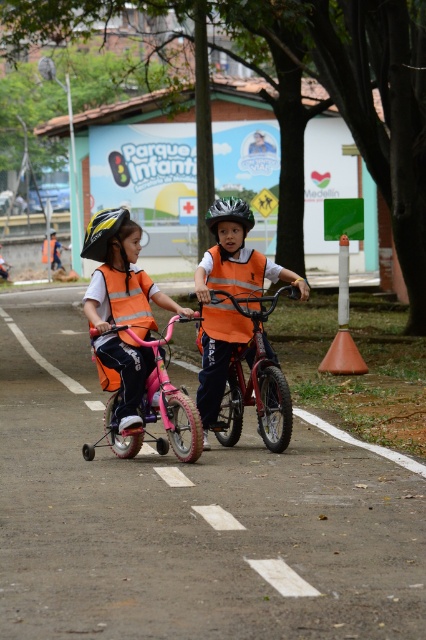
Who is more distant from viewer, (213, 298) or (97, 214)?

The point (97, 214) is behind.

Which of these two, metallic red bicycle at center or yellow matte bicycle helmet at left, stands shorter?

yellow matte bicycle helmet at left

In order to click on metallic red bicycle at center in this screenshot , I will do `click(255, 378)`.

Does pink matte bicycle at center appear under orange reflective safety vest at left?

Indeed, pink matte bicycle at center is positioned under orange reflective safety vest at left.

Is pink matte bicycle at center bigger than orange reflective safety vest at left?

Yes.

Which is in front, point (183, 406) or point (123, 289)?

Point (183, 406) is more forward.

Locate an element on the screen. pink matte bicycle at center is located at coordinates (154, 408).

Which is in front, point (104, 320) or point (221, 426)?

Point (104, 320)

Identify the location of matte orange vest at center. The image size is (426, 640). (121, 308).